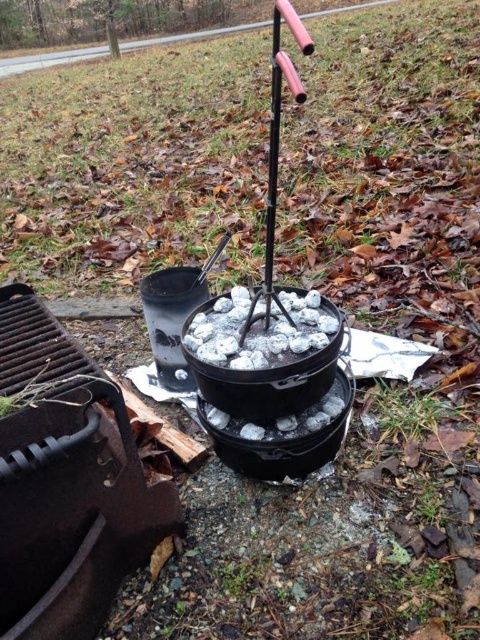
Based on the photo, which of these two, black cast iron grill at lower left or black cast iron pot at center, stands taller?

Standing taller between the two is black cast iron grill at lower left.

Does point (119, 556) come farther from viewer compared to point (233, 368)?

Yes, it is.

Is point (7, 588) positioned behind point (239, 300)?

No, (7, 588) is closer to viewer.

Identify the location of black cast iron grill at lower left. Image resolution: width=480 pixels, height=640 pixels. (67, 483).